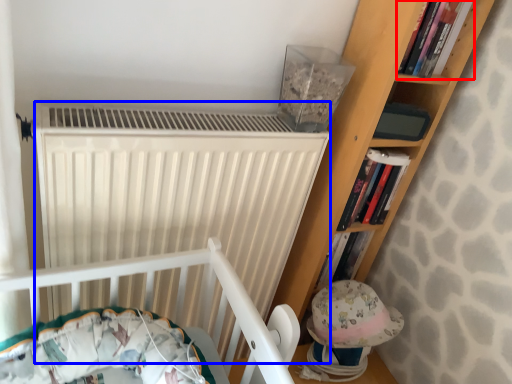
Question: Which object appears farthest to the camera in this image, book (highlighted by a red box) or radiator (highlighted by a blue box)?

Choices:
 (A) book
 (B) radiator

Answer: (A)